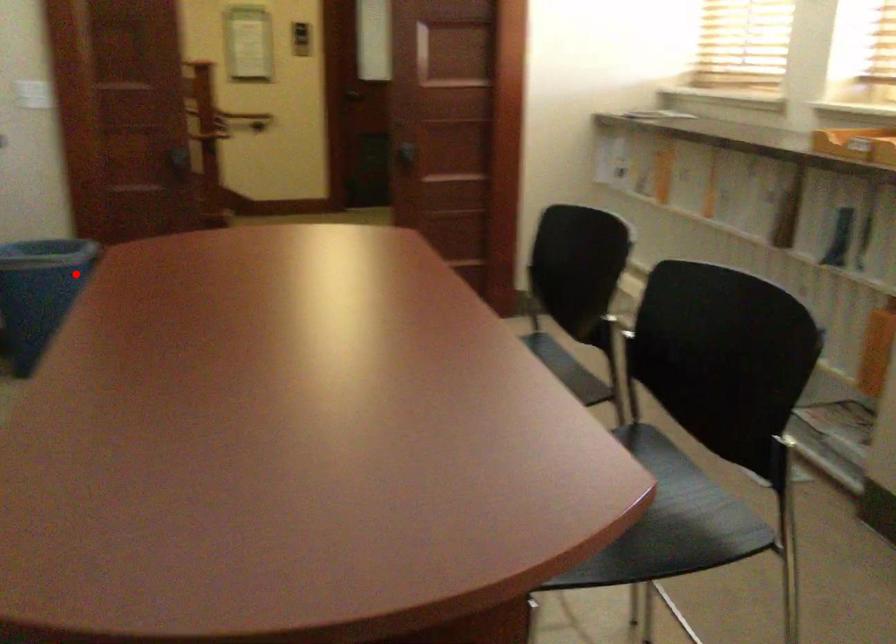
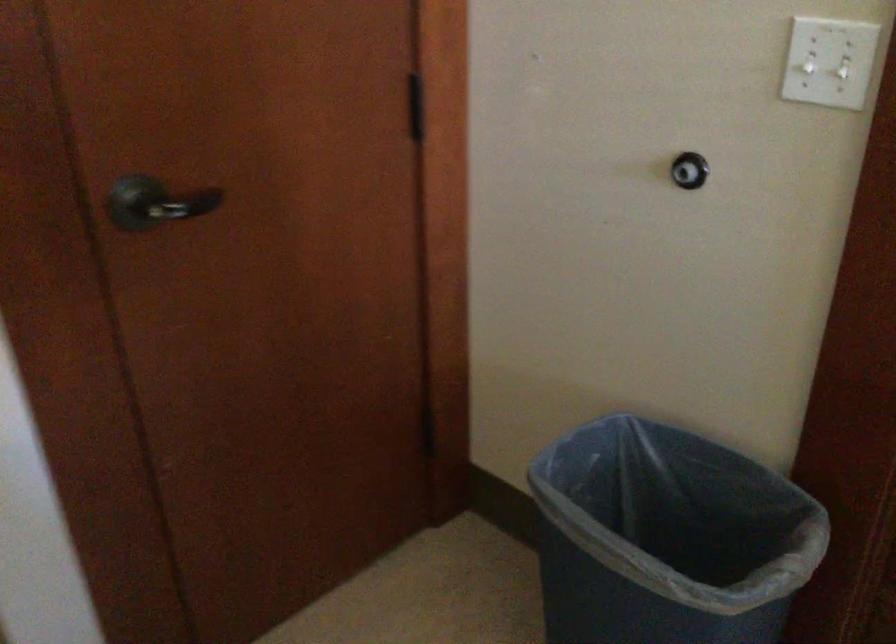
Question: I am providing you with two images of the same scene from different viewpoints. Image1 has a red point marked. In image2, the corresponding 3D location appears at what relative position? Reply with the corresponding letter.

Choices:
 (A) Closer
 (B) Farther

Answer: (A)